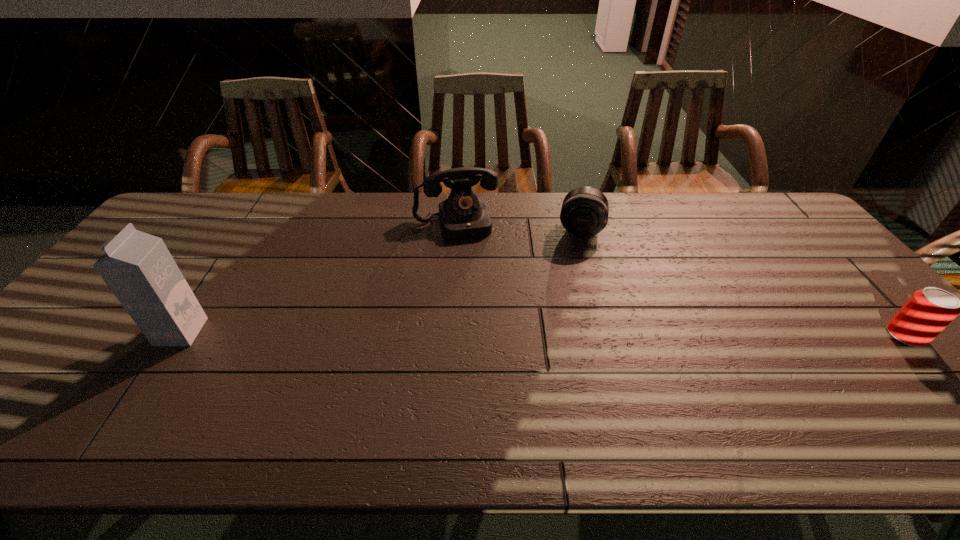
Find the location of a particular element. vacant space on the desktop that is between the tallest object and the beer can and is positioned on the front-facing side of the telephoto lens is located at coordinates (565, 334).

Identify the location of vacant space on the desktop that is between the tallest object and the rightmost object and is positioned on the dial of the third object from right to left. The height and width of the screenshot is (540, 960). (487, 334).